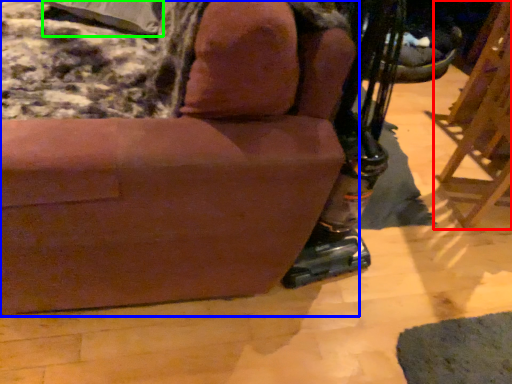
Question: Considering the real-world distances, which object is closest to furniture (highlighted by a red box)? chair (highlighted by a blue box) or pillow (highlighted by a green box).

Choices:
 (A) chair
 (B) pillow

Answer: (A)